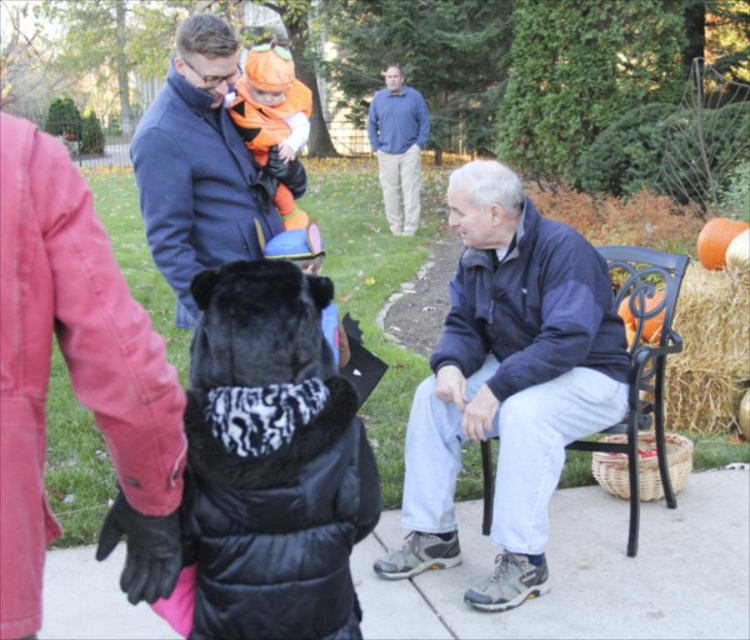
Question: Which of the following is the farthest from the observer?

Choices:
 (A) (669, 426)
 (B) (249, 108)

Answer: (A)

Question: Estimate the real-world distances between objects in this image. Which object is farther from the navy blue jacket at center?

Choices:
 (A) black wrought iron chair at right
 (B) orange fabric costume at upper center
 (C) blue cotton shirt at upper center

Answer: (C)

Question: Can you confirm if black furry coat at lower left is positioned to the left of black wrought iron chair at right?

Choices:
 (A) yes
 (B) no

Answer: (A)

Question: Which point is farther to the camera?

Choices:
 (A) (243, 83)
 (B) (230, 68)
 (C) (724, 344)

Answer: (C)

Question: Is navy blue jacket at center bigger than haybrown at right?

Choices:
 (A) no
 (B) yes

Answer: (B)

Question: Observing the image, what is the correct spatial positioning of navy blue jacket at center in reference to velvet blue coat at upper left?

Choices:
 (A) left
 (B) right

Answer: (B)